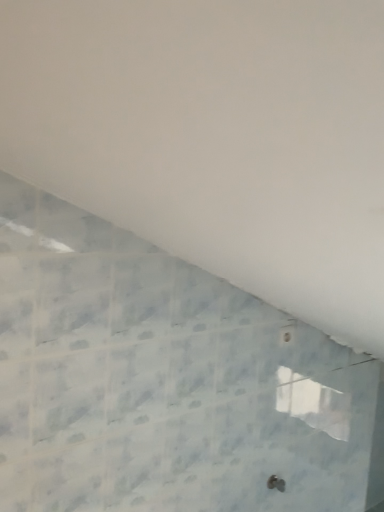
Locate an element on the screen. matte silver faucet at lower center is located at coordinates pos(276,483).

Image resolution: width=384 pixels, height=512 pixels. Describe the element at coordinates (276, 483) in the screenshot. I see `matte silver faucet at lower center` at that location.

Image resolution: width=384 pixels, height=512 pixels. In order to click on matte silver faucet at lower center in this screenshot , I will do `click(276, 483)`.